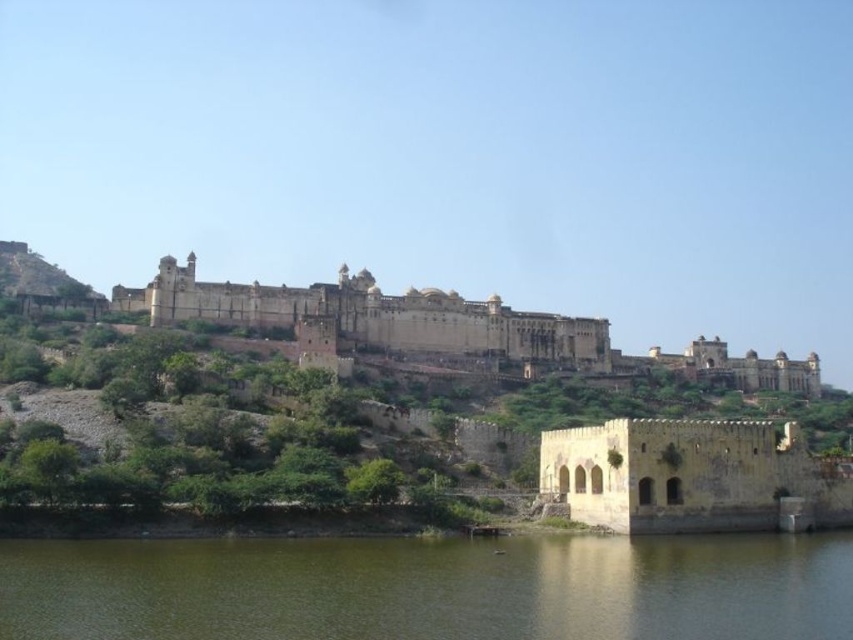
Question: Is yellow stone fort at lower right further to the viewer compared to brown stone palace at center?

Choices:
 (A) no
 (B) yes

Answer: (A)

Question: Is yellow stone fort at lower right to the left of brown stone palace at center from the viewer's perspective?

Choices:
 (A) yes
 (B) no

Answer: (B)

Question: Estimate the real-world distances between objects in this image. Which object is closer to the yellow stone fort at lower right?

Choices:
 (A) brown stone palace at center
 (B) greenish water at lower center

Answer: (B)

Question: Does greenish water at lower center come in front of brown stone palace at center?

Choices:
 (A) no
 (B) yes

Answer: (B)

Question: Based on their relative distances, which object is farther from the brown stone palace at center?

Choices:
 (A) yellow stone fort at lower right
 (B) greenish water at lower center

Answer: (B)

Question: Among these objects, which one is nearest to the camera?

Choices:
 (A) yellow stone fort at lower right
 (B) greenish water at lower center
 (C) brown stone palace at center

Answer: (B)